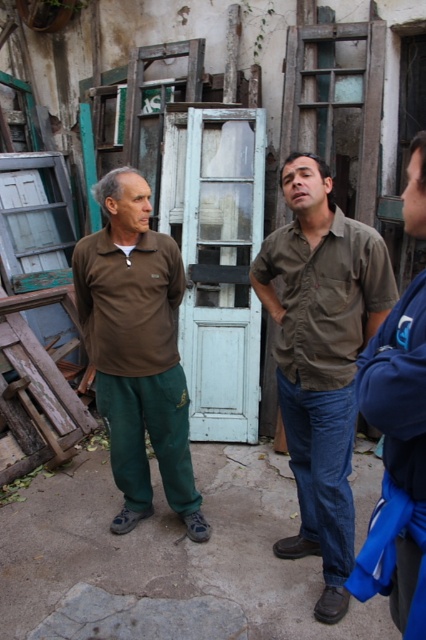
Does matte brown shirt at center appear over white wooden door at center?

No, matte brown shirt at center is not above white wooden door at center.

Who is positioned more to the left, matte brown shirt at center or white wooden door at center?

white wooden door at center is more to the left.

Between point (377, 285) and point (252, 192), which one is positioned in front?

Positioned in front is point (377, 285).

This screenshot has height=640, width=426. Identify the location of matte brown shirt at center. (322, 356).

Does matte brown shirt at center have a smaller size compared to matte brown shirt at left?

Correct, matte brown shirt at center occupies less space than matte brown shirt at left.

Which is more to the right, matte brown shirt at center or matte brown shirt at left?

matte brown shirt at center

What do you see at coordinates (322, 356) in the screenshot? I see `matte brown shirt at center` at bounding box center [322, 356].

Identify the location of matte brown shirt at center. The image size is (426, 640). (322, 356).

Between matte brown shirt at center and blue fleece jacket at right, which one is positioned higher?

blue fleece jacket at right is higher up.

Describe the element at coordinates (322, 356) in the screenshot. The width and height of the screenshot is (426, 640). I see `matte brown shirt at center` at that location.

Is point (328, 404) less distant than point (417, 566)?

No, (328, 404) is further to viewer.

I want to click on matte brown shirt at center, so [x=322, y=356].